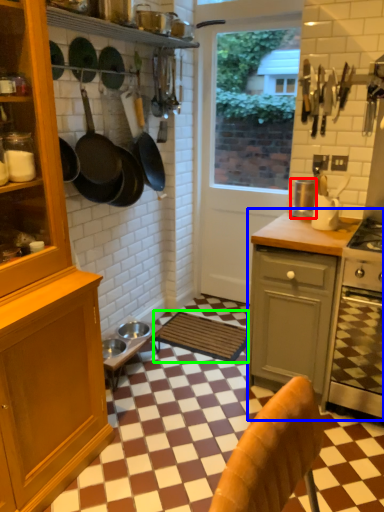
Question: Which object is positioned closest to kitchen appliance (highlighted by a red box)? Select from countertop (highlighted by a blue box) and mat (highlighted by a green box).

Choices:
 (A) countertop
 (B) mat

Answer: (A)